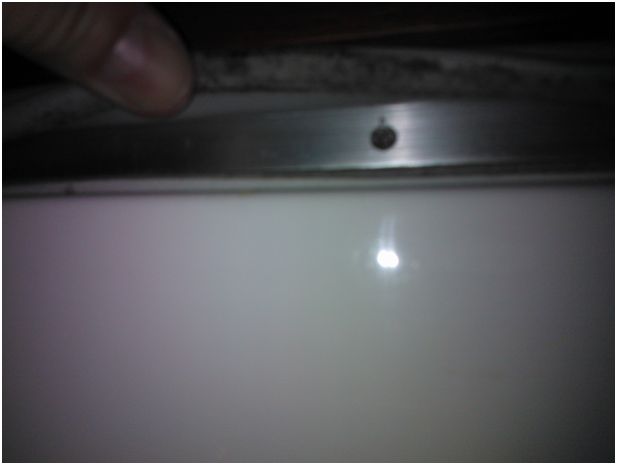
Where is `dirty spot`? dirty spot is located at coordinates point(72,193).